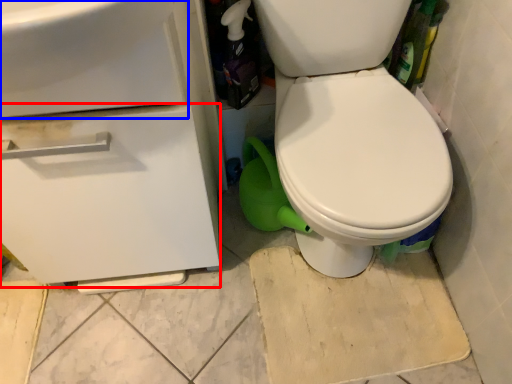
Question: Which object appears farthest to the camera in this image, drawer (highlighted by a red box) or sink (highlighted by a blue box)?

Choices:
 (A) drawer
 (B) sink

Answer: (A)